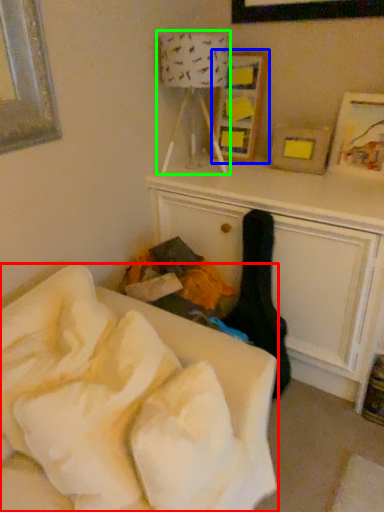
Question: Which is farther away from furniture (highlighted by a red box)? picture frame (highlighted by a blue box) or lamp (highlighted by a green box)?

Choices:
 (A) picture frame
 (B) lamp

Answer: (A)